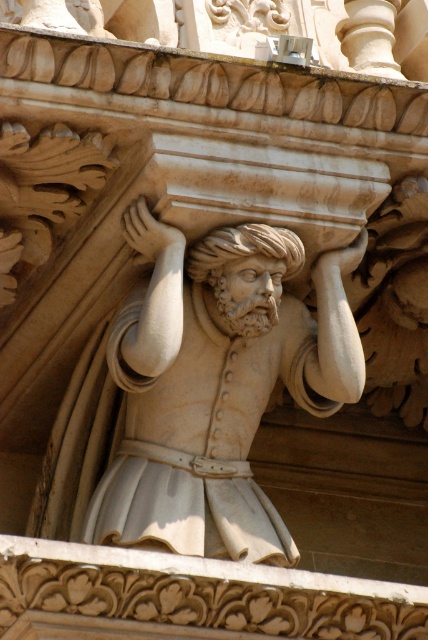
Based on the photo, you are an art conservator standing at the entrance of a museum gallery. You need to place a protective barrier around the white marble statue at center. The barrier must be placed exactly 1 meter away from the statue in all directions. Given that the gallery floor has a coordinate system where the statue is at point 0.602, 0.507, what coordinates should the barrier be placed at to ensure it is 1 meter away in all directions?

The barrier should be placed around the white marble statue at center with coordinates [216,385], maintaining a 1 meter distance in all directions as specified.

You are an art conservator standing 10 feet away from the white marble statue at center. You need to reach the white marble head at center to clean it. Can you reach it without moving closer? Please explain.

The white marble statue at center is 15.12 feet away from the white marble head at center. Since you are already 10 feet away from the statue, the total distance to the head would be 10 feet plus 15.12 feet, totaling 25.12 feet. At this distance, it would be difficult to reach the head without moving closer.